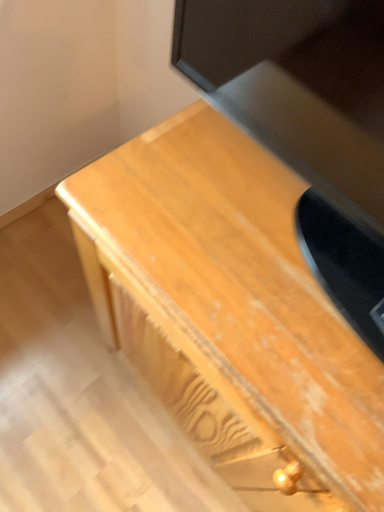
Describe the element at coordinates (230, 311) in the screenshot. Image resolution: width=384 pixels, height=512 pixels. I see `light wood desk at center` at that location.

In the scene shown: Measure the distance between light wood desk at center and camera.

light wood desk at center is 16.95 inches from camera.

The image size is (384, 512). In order to click on light wood desk at center in this screenshot , I will do `click(230, 311)`.

The width and height of the screenshot is (384, 512). Find the location of `light wood desk at center`. light wood desk at center is located at coordinates (230, 311).